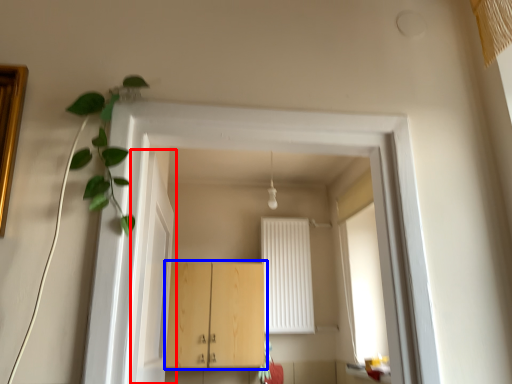
Question: Among these objects, which one is farthest to the camera, door (highlighted by a red box) or cabinetry (highlighted by a blue box)?

Choices:
 (A) door
 (B) cabinetry

Answer: (B)